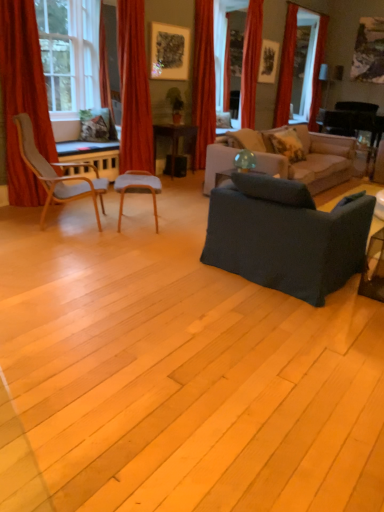
The height and width of the screenshot is (512, 384). What are the coordinates of `vacant area that lies in front of matte gray chair at center, the 2th chair from the left` in the screenshot? It's located at (134, 242).